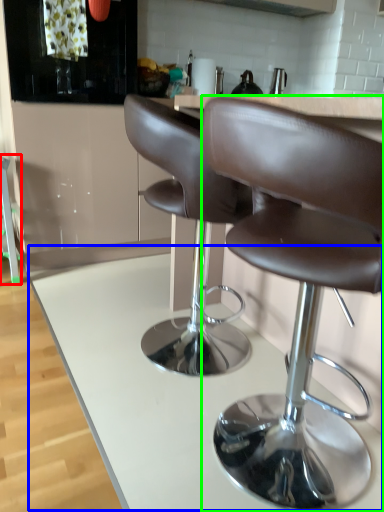
Question: Which object is the closest to the bar stool (highlighted by a red box)? Choose among these: counter (highlighted by a blue box) or chair (highlighted by a green box).

Choices:
 (A) counter
 (B) chair

Answer: (A)